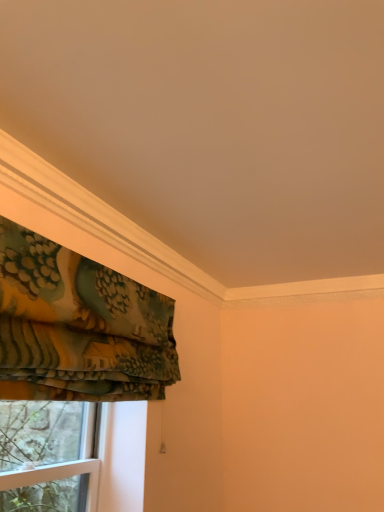
Describe the element at coordinates (78, 326) in the screenshot. I see `floral fabric curtain at left` at that location.

At what (x,y) coordinates should I click in order to perform the action: click on floral fabric curtain at left. Please return your answer as a coordinate pair (x, y). Looking at the image, I should click on (78, 326).

What is the approximate width of floral fabric curtain at left?

The width of floral fabric curtain at left is 5.99 inches.

The image size is (384, 512). I want to click on floral fabric curtain at left, so click(x=78, y=326).